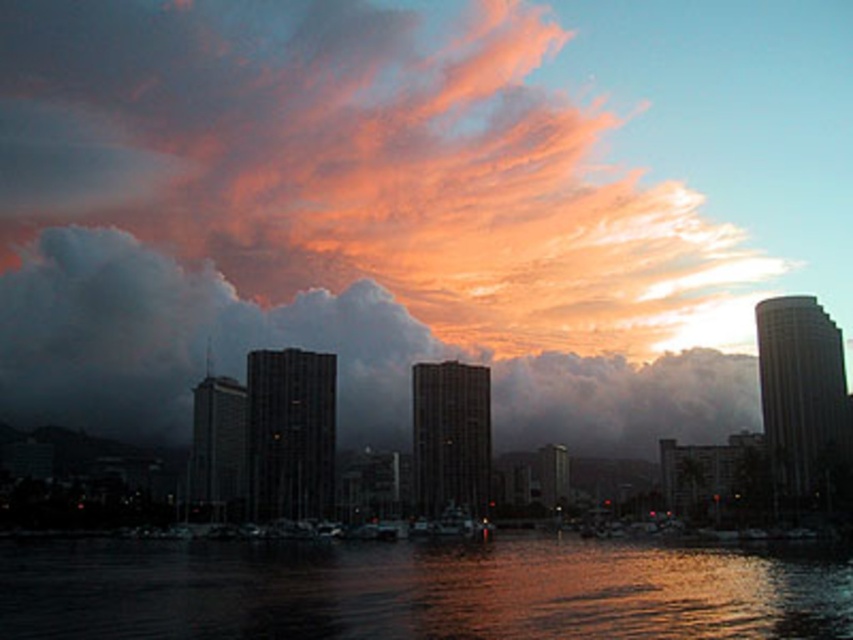
You are a photographer trying to capture the cloudy sky at upper center in your shot. Based on its position, which part of the image should you focus on to ensure it is centered in your viewfinder?

The cloudy sky at upper center is located at point coordinates (183, 339), so you should focus on the upper center area of the image to center it in your viewfinder.

Based on the photo, you are an artist painting the sunset scene. You want to ensure the cloudy sky at upper center and the glistening dark water at lower center are positioned correctly. Which object should be placed higher in your painting?

The cloudy sky at upper center should be placed higher in the painting since it is located above the glistening dark water at lower center.

You are standing on the waterfront and looking at the cloudy sky at upper center and the glistening dark water at lower center. Which object is closer to you?

The cloudy sky at upper center is closer to you because it is further to the viewer than the glistening dark water at lower center.